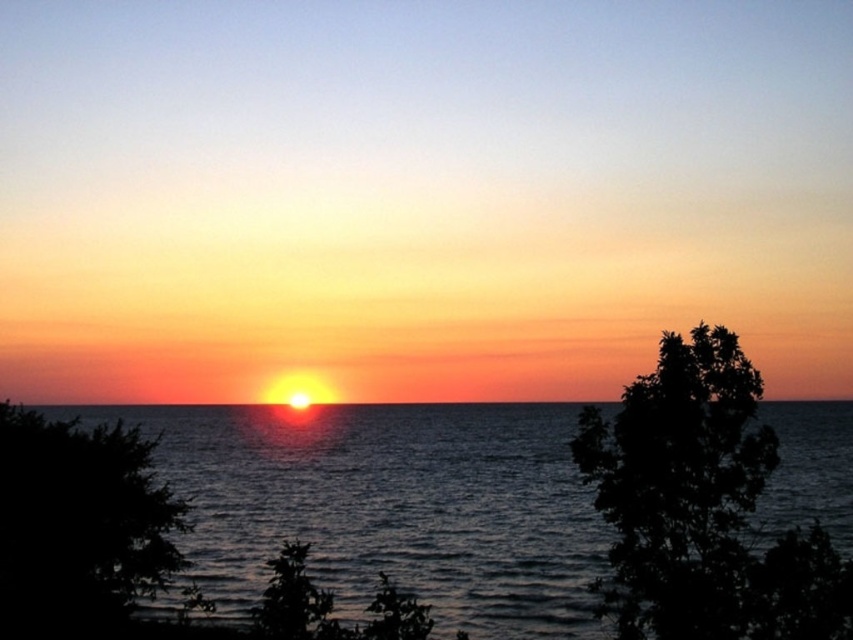
Question: Which point is farther from the camera taking this photo?

Choices:
 (A) (439, 436)
 (B) (668, 385)
 (C) (84, 451)

Answer: (A)

Question: Is glistening blue water at center smaller than silhouette leafy tree at right?

Choices:
 (A) no
 (B) yes

Answer: (A)

Question: Is glistening blue water at center bigger than dark green leafy tree at lower left?

Choices:
 (A) no
 (B) yes

Answer: (B)

Question: Does silhouette leafy tree at right come behind dark green leafy tree at lower left?

Choices:
 (A) yes
 (B) no

Answer: (B)

Question: Which object is positioned farthest from the silhouette leafy tree at right?

Choices:
 (A) dark green leafy tree at lower left
 (B) glistening blue water at center

Answer: (B)

Question: Which point appears farthest from the camera in this image?

Choices:
 (A) (676, 397)
 (B) (480, 518)

Answer: (B)